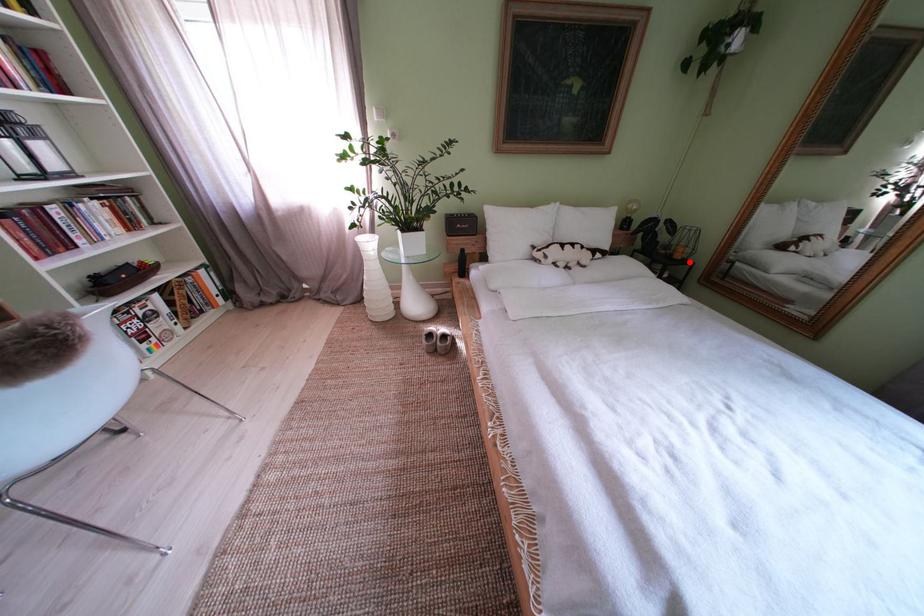
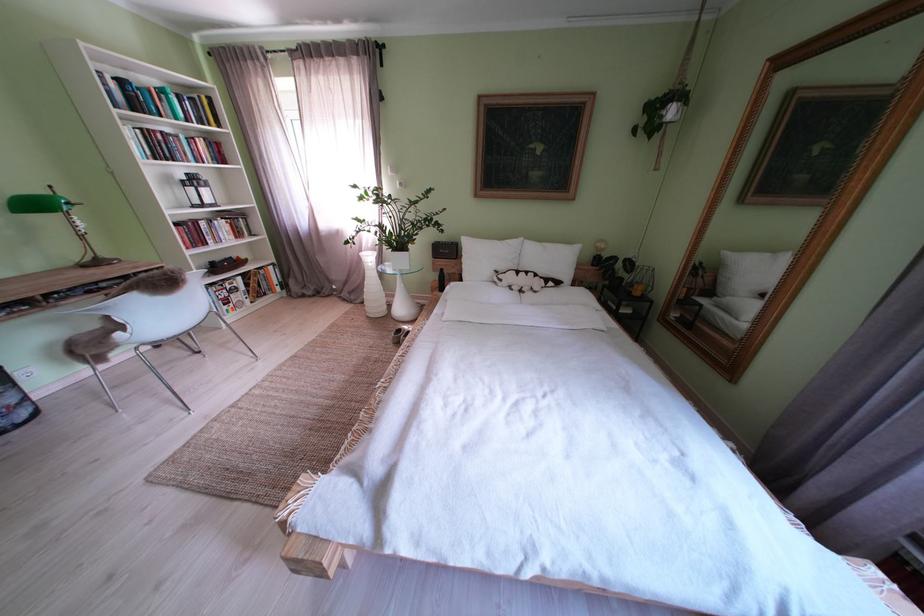
Locate, in the second image, the point that corresponds to the highlighted location in the first image.

(648, 299)